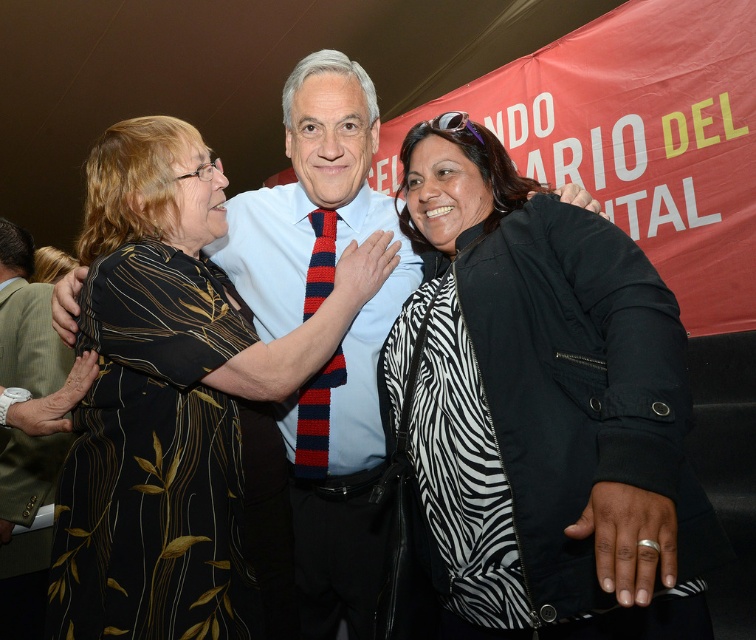
You are standing in front of the group at the event and want to hand a gift to the person wearing the zebra print jacket at center and the black printed dress at center. Which one should you approach first based on their positions?

The zebra print jacket at center is closer to the viewer than the black printed dress at center, so you should approach the person wearing the zebra print jacket at center first.

You are a photographer at the event and want to capture a closeup of both the black printed dress at center and the knitted red and navy striped tie at center in a single frame. Can you fit both in the shot without moving the camera?

The black printed dress at center and knitted red and navy striped tie at center are 12.13 inches apart. If your camera lens can capture objects within a 12.13 inch distance in the same frame, then yes, they can be included together without moving the camera.

From the picture: You are a photographer at the event and want to ensure both the black printed dress at center and the knitted red and navy striped tie at center are visible in your photo. Given their sizes, which one might you need to adjust your focus to capture more carefully?

The black printed dress at center is taller than the knitted red and navy striped tie at center, so you might need to adjust your focus more carefully on the knitted red and navy striped tie at center to ensure it is clearly visible in the photo.